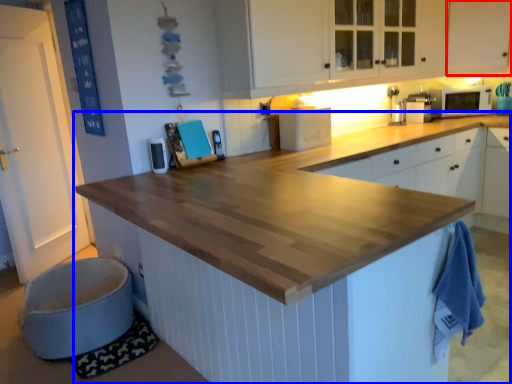
Question: Which object appears closest to the camera in this image, cabinetry (highlighted by a red box) or countertop (highlighted by a blue box)?

Choices:
 (A) cabinetry
 (B) countertop

Answer: (B)